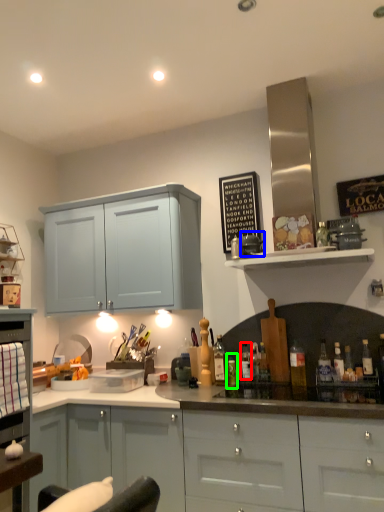
Question: Which object is positioned closest to bottle (highlighted by a red box)? Select from appliance (highlighted by a blue box) and bottle (highlighted by a green box).

Choices:
 (A) appliance
 (B) bottle

Answer: (B)